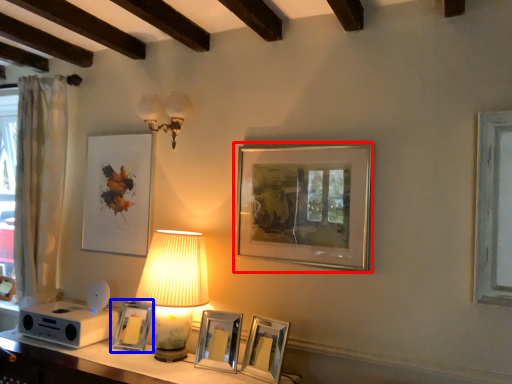
Question: Which point is further to the camera, picture frame (highlighted by a red box) or picture frame (highlighted by a blue box)?

Choices:
 (A) picture frame
 (B) picture frame

Answer: (B)